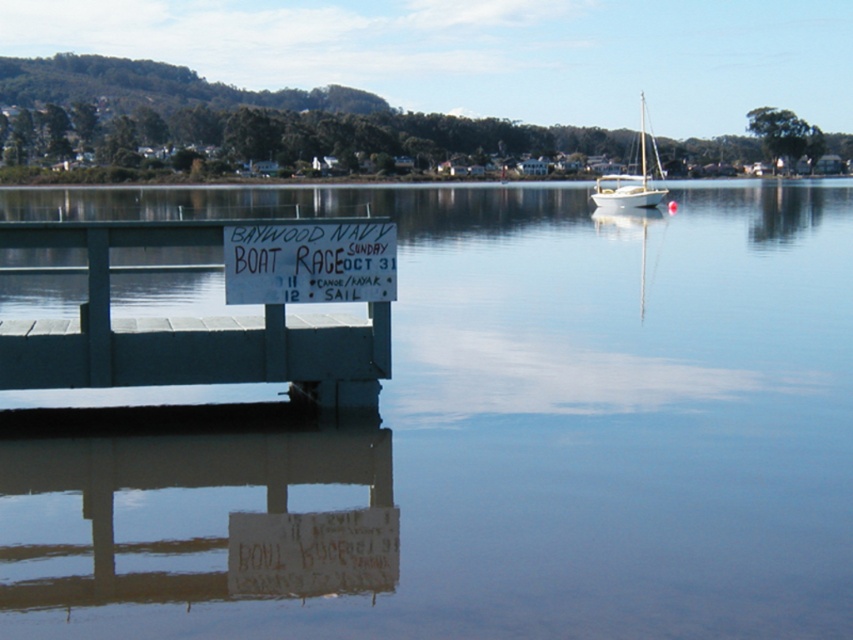
You are standing at the camera position and want to reach the point at coordinates [412,236]. Can you walk directly to it from where you are?

The point at coordinates [412,236] is 117.44 feet away from the camera position. Since there is no mention of obstacles in the scene description, you can walk directly to it if there is a clear path, but the distance might require some time to cover.